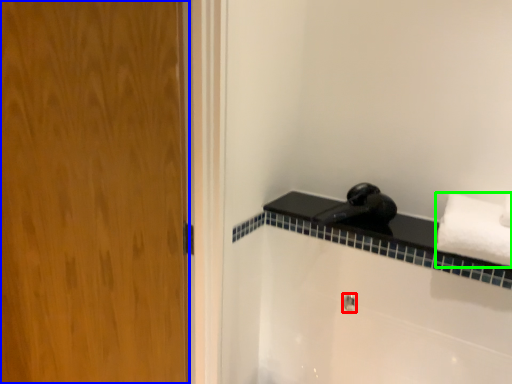
Question: Estimate the real-world distances between objects in this image. Which object is closer to shower (highlighted by a red box), door (highlighted by a blue box) or towel (highlighted by a green box)?

Choices:
 (A) door
 (B) towel

Answer: (B)